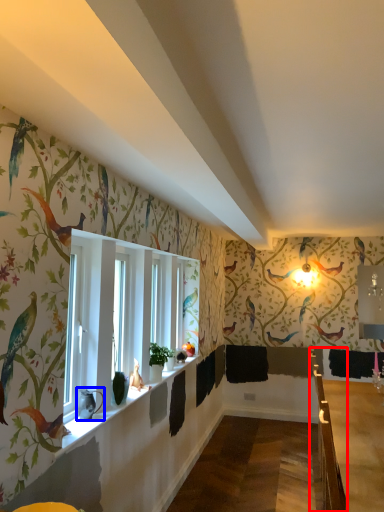
Question: Which object is closer to the camera taking this photo, rail (highlighted by a red box) or animal (highlighted by a blue box)?

Choices:
 (A) rail
 (B) animal

Answer: (B)